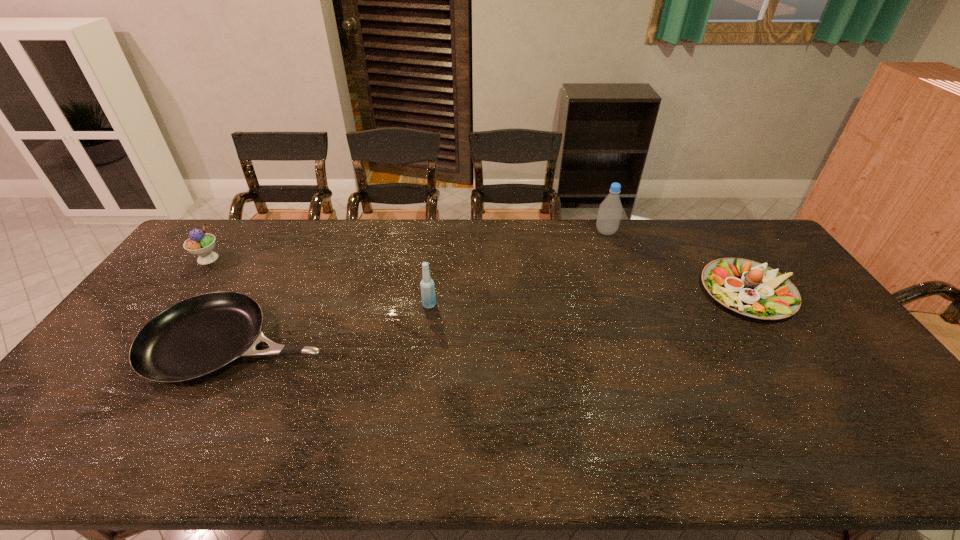
You are a GUI agent. You are given a task and a screenshot of the screen. Output one action in this format:
    pyautogui.click(x=<x>, y=<y>)
    Task: Click on the vacant point located between the fourth shortest object and the salad plate
    The height and width of the screenshot is (540, 960).
    Given the screenshot: What is the action you would take?
    pyautogui.click(x=589, y=299)

Image resolution: width=960 pixels, height=540 pixels. I want to click on vacant space that is in between the nearer bottle and the second shortest object, so click(589, 299).

The width and height of the screenshot is (960, 540). Find the location of `vacant space that's between the second tallest object and the salad plate`. vacant space that's between the second tallest object and the salad plate is located at coordinates (589, 299).

Where is `free space that is in between the tallest object and the icecream`? The width and height of the screenshot is (960, 540). free space that is in between the tallest object and the icecream is located at coordinates (407, 245).

Image resolution: width=960 pixels, height=540 pixels. I want to click on object identified as the fourth closest to the icecream, so [x=747, y=287].

You are a GUI agent. You are given a task and a screenshot of the screen. Output one action in this format:
    pyautogui.click(x=<x>, y=<y>)
    Task: Click on the object that can be found as the fourth closest to the third object from left to right
    This screenshot has width=960, height=540.
    Given the screenshot: What is the action you would take?
    pyautogui.click(x=747, y=287)

This screenshot has width=960, height=540. Identify the location of free location that satisfies the following two spatial constraints: 1. on the front side of the shortest object; 2. on the right side of the icecream. (146, 342).

Locate an element on the screen. This screenshot has width=960, height=540. free space that satisfies the following two spatial constraints: 1. on the back side of the farther bottle; 2. on the right side of the second tallest object is located at coordinates (439, 232).

I want to click on vacant position in the image that satisfies the following two spatial constraints: 1. on the back side of the fourth object from left to right; 2. on the right side of the icecream, so click(x=228, y=232).

Locate an element on the screen. The width and height of the screenshot is (960, 540). vacant space that satisfies the following two spatial constraints: 1. on the back side of the third shortest object; 2. on the left side of the farthest object is located at coordinates (228, 232).